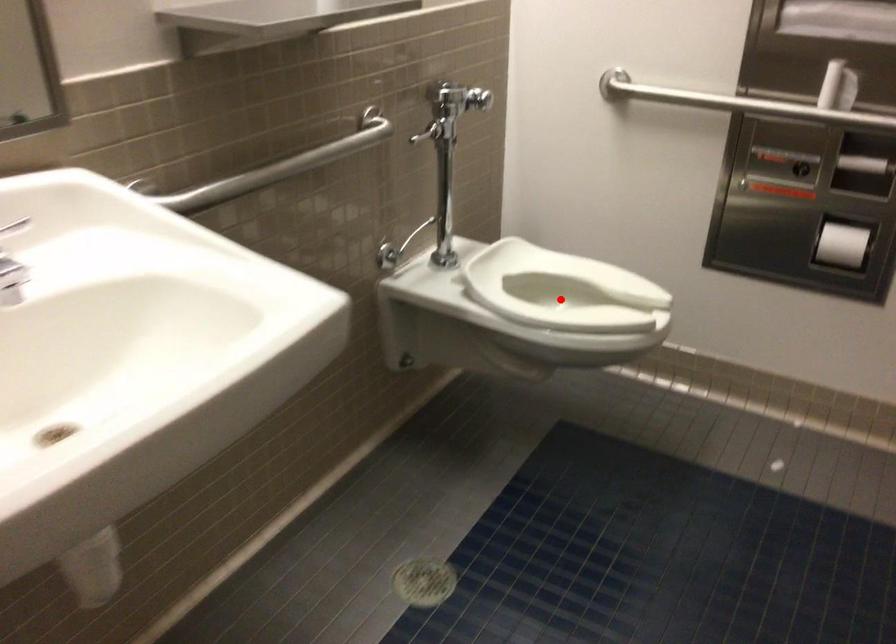
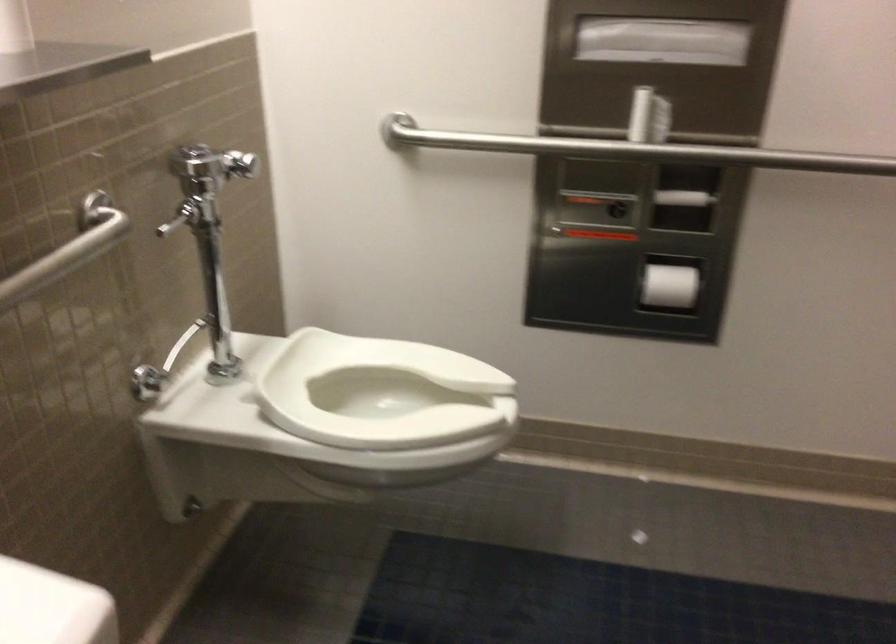
Question: I am providing you with two images of the same scene from different viewpoints. A red point is shown in image1. For the corresponding object point in image2, is it positioned nearer or farther from the camera?

Choices:
 (A) Nearer
 (B) Farther

Answer: (A)